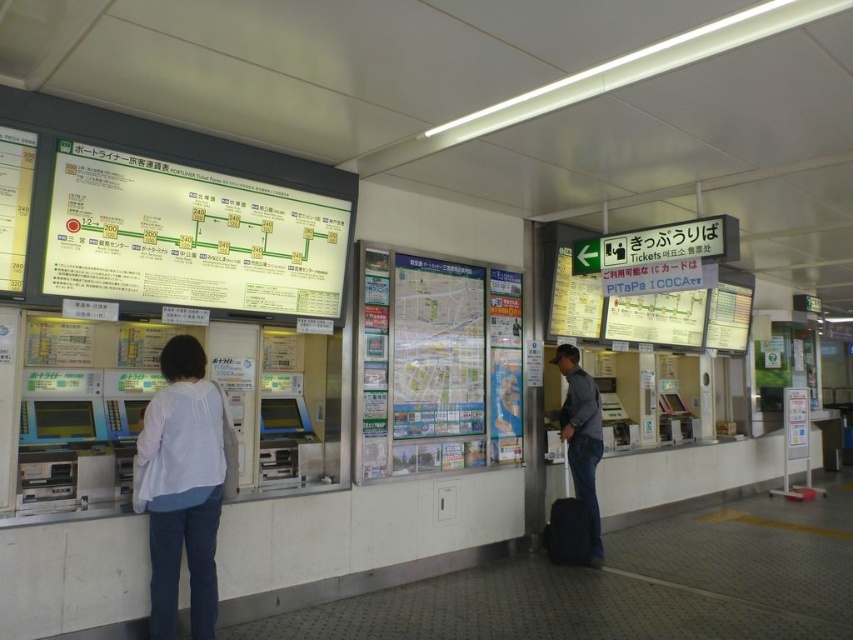
Which is more to the left, denim jacket at center or black fabric suitcase at lower right?

Positioned to the left is black fabric suitcase at lower right.

Between denim jacket at center and black fabric suitcase at lower right, which one is positioned higher?

denim jacket at center

Is point (585, 468) positioned behind point (583, 547)?

Yes.

Identify the location of denim jacket at center. The height and width of the screenshot is (640, 853). (581, 435).

Which is below, white glossy signboard at upper left or denim jacket at center?

denim jacket at center is below.

Can you confirm if white glossy signboard at upper left is positioned below denim jacket at center?

No.

Between point (180, 168) and point (593, 499), which one is positioned behind?

Positioned behind is point (593, 499).

Locate an element on the screen. The width and height of the screenshot is (853, 640). white glossy signboard at upper left is located at coordinates (190, 236).

Between point (181, 166) and point (547, 548), which one is positioned in front?

Point (181, 166) is more forward.

Where is `white glossy signboard at upper left`? Image resolution: width=853 pixels, height=640 pixels. white glossy signboard at upper left is located at coordinates (190, 236).